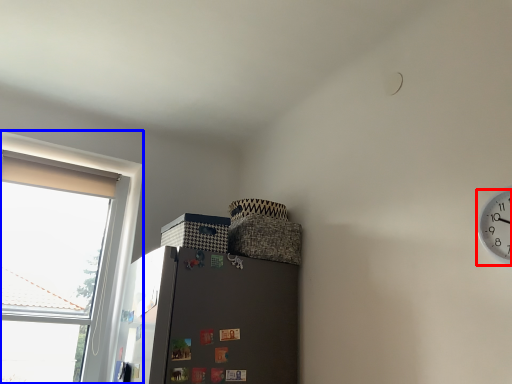
Question: Which point is closer to the camera, clock (highlighted by a red box) or window (highlighted by a blue box)?

Choices:
 (A) clock
 (B) window

Answer: (A)